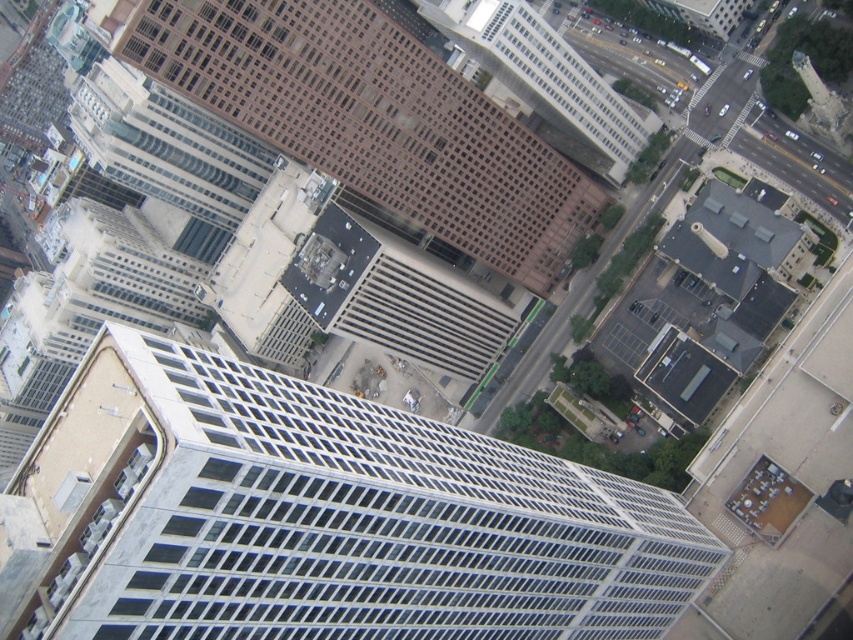
You are a city planner analyzing the urban layout. You need to determine which building, the white glass building at center or the brown glass building at center, has a greater height. Based on the aerial view provided, which one is taller?

The white glass building at center is much taller than the brown glass building at center, so the white glass building at center is taller.

You are a city planner analyzing the urban layout. Given the brown glassy building at upper center and the brown glass building at center, which one has a greater width according to the aerial view?

The brown glassy building at upper center has a greater width than the brown glass building at center as stated in the description.